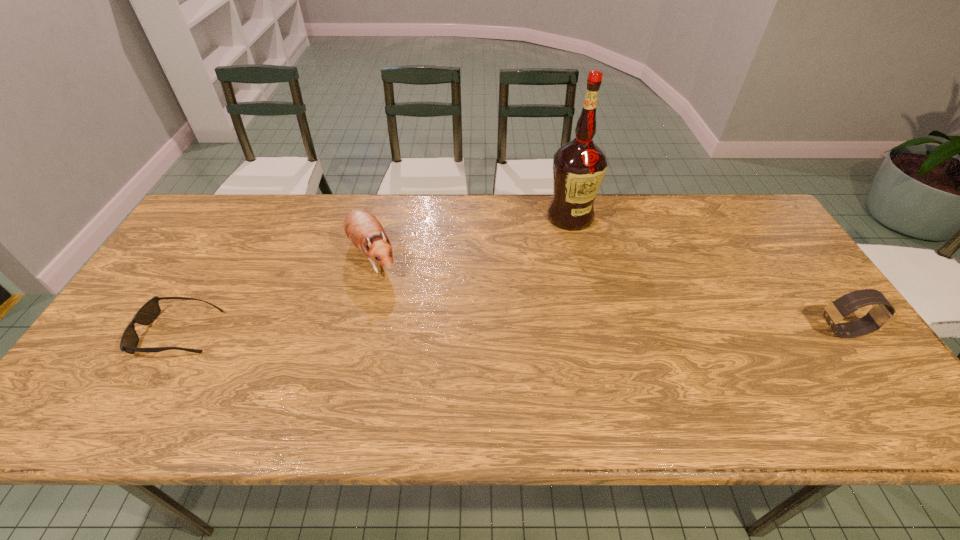
This screenshot has width=960, height=540. I want to click on the leftmost object, so click(x=150, y=310).

I want to click on sunglasses, so click(x=150, y=310).

This screenshot has width=960, height=540. What are the coordinates of `the rightmost object` in the screenshot? It's located at (882, 314).

Identify the location of the third object from left to right. The height and width of the screenshot is (540, 960). 579,166.

Locate an element on the screen. This screenshot has height=540, width=960. the tallest object is located at coordinates click(x=579, y=166).

The width and height of the screenshot is (960, 540). Find the location of `hamster`. hamster is located at coordinates (362, 228).

Locate an element on the screen. The height and width of the screenshot is (540, 960). vacant space situated on the label of the tallest object is located at coordinates (553, 260).

At what (x,y) coordinates should I click in order to perform the action: click on free space located on the label of the tallest object. Please return your answer as a coordinate pair (x, y). The image size is (960, 540). Looking at the image, I should click on (542, 286).

I want to click on free space located on the label of the tallest object, so (541, 289).

The height and width of the screenshot is (540, 960). I want to click on free space located at the face of the third object from right to left, so click(x=408, y=332).